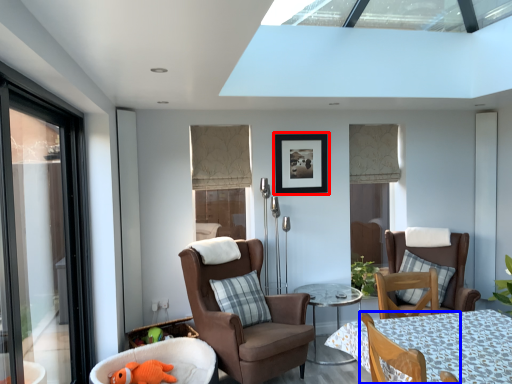
Question: Which of the following is the farthest to the observer, picture frame (highlighted by a red box) or chair (highlighted by a blue box)?

Choices:
 (A) picture frame
 (B) chair

Answer: (A)